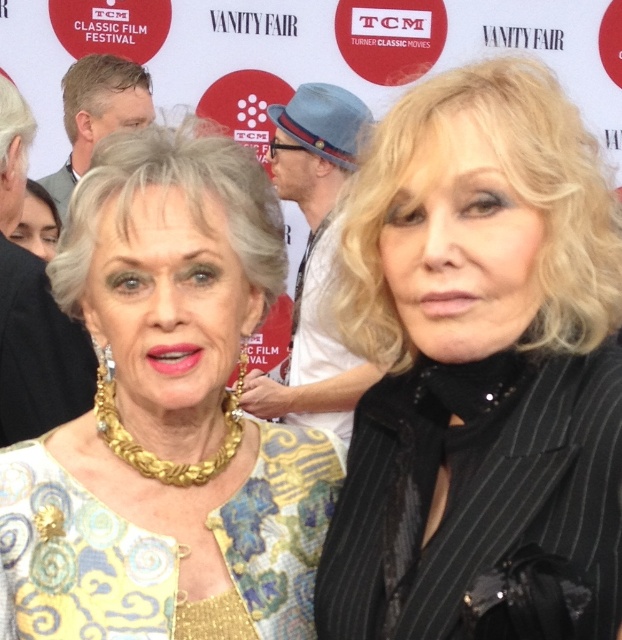
Question: Can you confirm if gold textured necklace at center is positioned to the right of gray hair at upper left?

Choices:
 (A) yes
 (B) no

Answer: (A)

Question: Which is farther from the gold chain necklace at center?

Choices:
 (A) gold textured necklace at center
 (B) gray hair at upper left
 (C) black pinstripe suit at right

Answer: (B)

Question: Is black pinstripe suit at right positioned in front of gray hair at upper left?

Choices:
 (A) yes
 (B) no

Answer: (A)

Question: Which point is closer to the camera?

Choices:
 (A) blue felt hat at center
 (B) gold chain necklace at center

Answer: (B)

Question: Can you confirm if black pinstripe suit at right is bigger than gold textured necklace at center?

Choices:
 (A) no
 (B) yes

Answer: (B)

Question: Which of these objects is positioned closest to the gold chain necklace at center?

Choices:
 (A) gold textured necklace at center
 (B) blue felt hat at center
 (C) black pinstripe suit at right

Answer: (A)